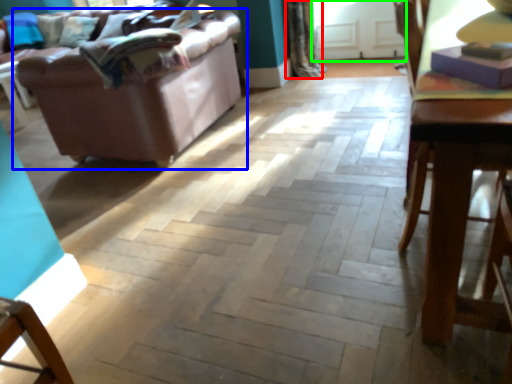
Question: Which is farther away from curtain (highlighted by a red box)? studio couch (highlighted by a blue box) or glass door (highlighted by a green box)?

Choices:
 (A) studio couch
 (B) glass door

Answer: (A)